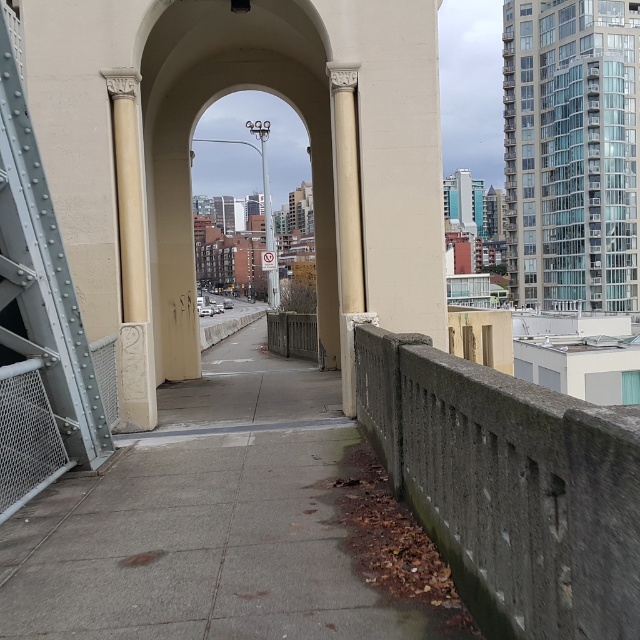
Which of these two, white stone column at left or white marble column at center, stands taller?

With more height is white marble column at center.

Does white stone column at left have a greater width compared to white marble column at center?

No.

Is point (108, 68) closer to viewer compared to point (356, 198)?

That is True.

You are a GUI agent. You are given a task and a screenshot of the screen. Output one action in this format:
    pyautogui.click(x=<x>, y=<y>)
    Task: Click on the white stone column at left
    
    Given the screenshot: What is the action you would take?
    pyautogui.click(x=131, y=259)

Looking at this image, which is more to the left, gray concrete pavement at center or white marble column at center?

gray concrete pavement at center is more to the left.

Which is in front, point (440, 573) or point (346, 161)?

Point (440, 573) is more forward.

Locate an element on the screen. The height and width of the screenshot is (640, 640). gray concrete pavement at center is located at coordinates (228, 524).

Locate an element on the screen. The width and height of the screenshot is (640, 640). gray concrete pavement at center is located at coordinates (228, 524).